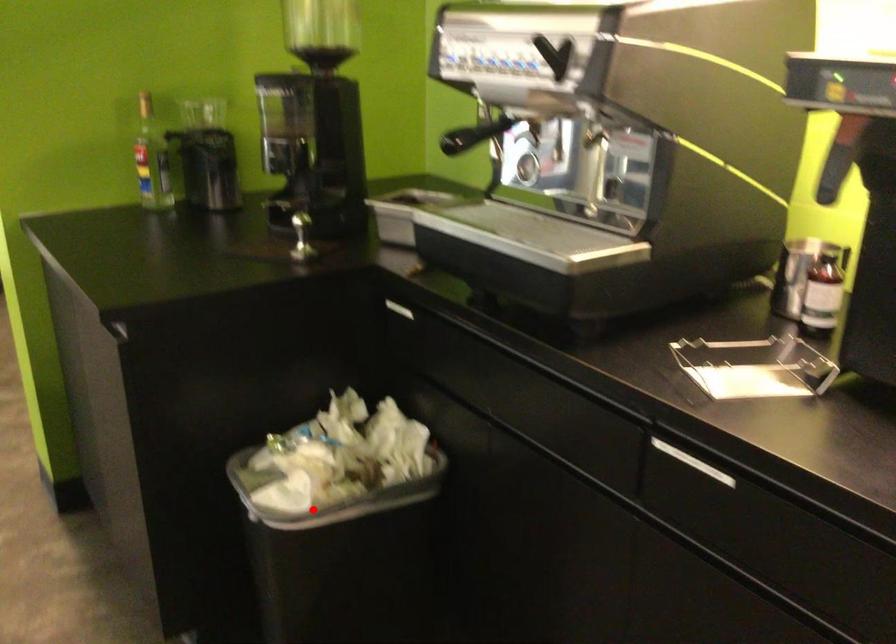
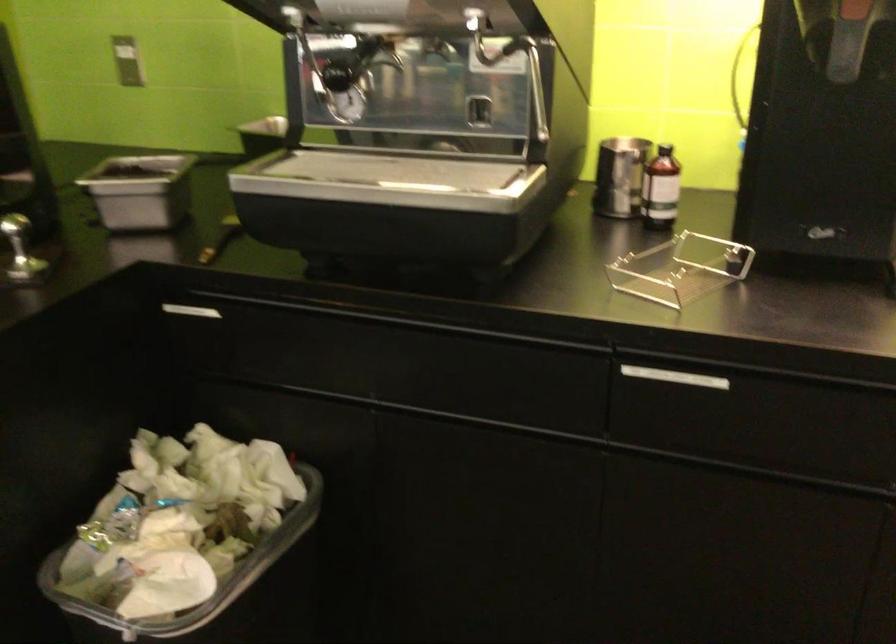
Question: I am providing you with two images of the same scene from different viewpoints. Given a red point in image1, look at the same physical point in image2. Is it:

Choices:
 (A) Closer to the viewpoint
 (B) Farther from the viewpoint

Answer: (A)